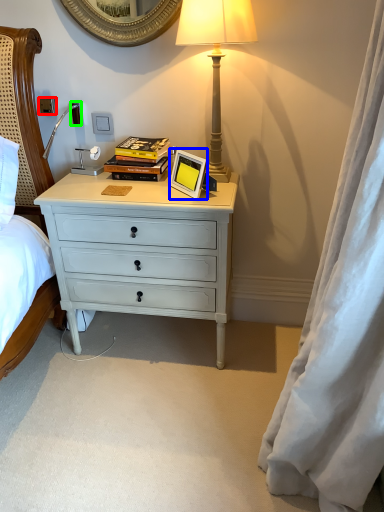
Question: Which object is the closest to the power outlet (highlighted by a red box)? Choose among these: picture frame (highlighted by a blue box) or power outlet (highlighted by a green box).

Choices:
 (A) picture frame
 (B) power outlet

Answer: (B)